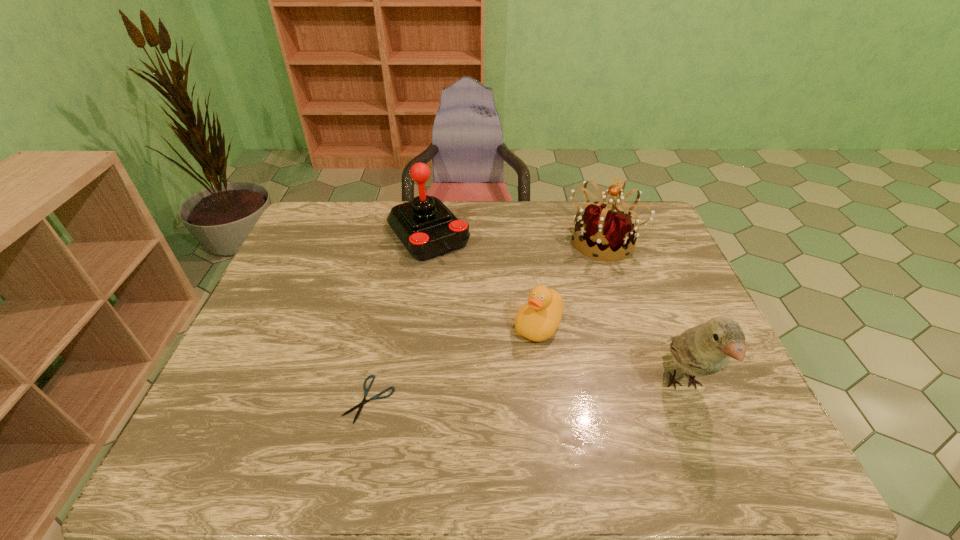
The width and height of the screenshot is (960, 540). What are the coordinates of `vacant space situated 0.110m on the base of the joystick` in the screenshot? It's located at (464, 280).

Where is `free point located 0.210m on the base of the joystick`? The width and height of the screenshot is (960, 540). free point located 0.210m on the base of the joystick is located at coordinates (480, 301).

Image resolution: width=960 pixels, height=540 pixels. What are the coordinates of `vacant space situated 0.180m on the base of the joystick` in the screenshot? It's located at (475, 295).

Identify the location of free space located 0.200m on the front-facing side of the tiara. The height and width of the screenshot is (540, 960). (567, 300).

The height and width of the screenshot is (540, 960). I want to click on vacant space located on the front-facing side of the tiara, so coord(546,336).

The width and height of the screenshot is (960, 540). In order to click on free space located on the front-facing side of the tiara in this screenshot , I will do `click(586, 269)`.

The height and width of the screenshot is (540, 960). Identify the location of joystick present at the far edge. (427, 228).

The image size is (960, 540). Identify the location of tiara present at the far edge. (605, 227).

I want to click on shears that is at the near edge, so click(366, 390).

Where is `bird that is at the near edge`? This screenshot has width=960, height=540. bird that is at the near edge is located at coordinates (705, 349).